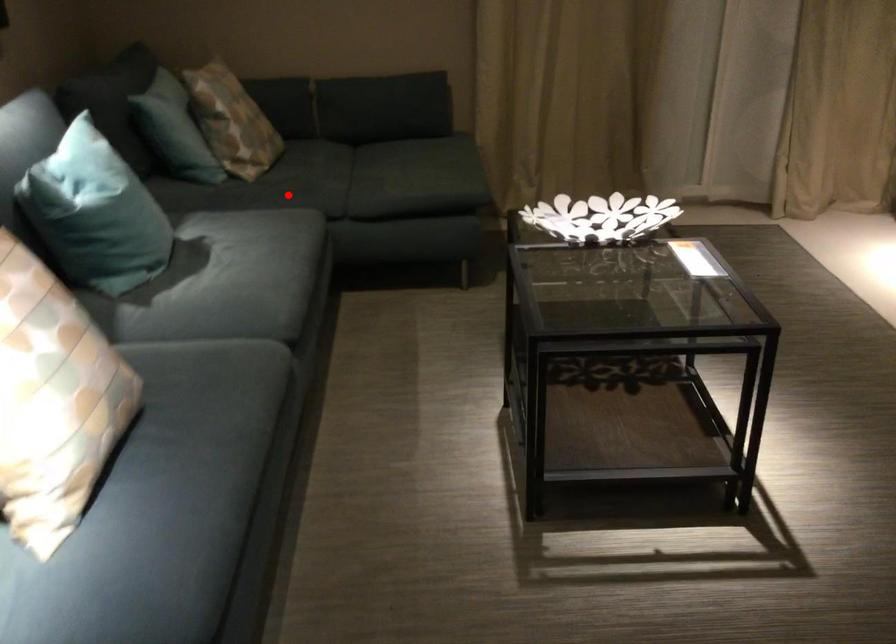
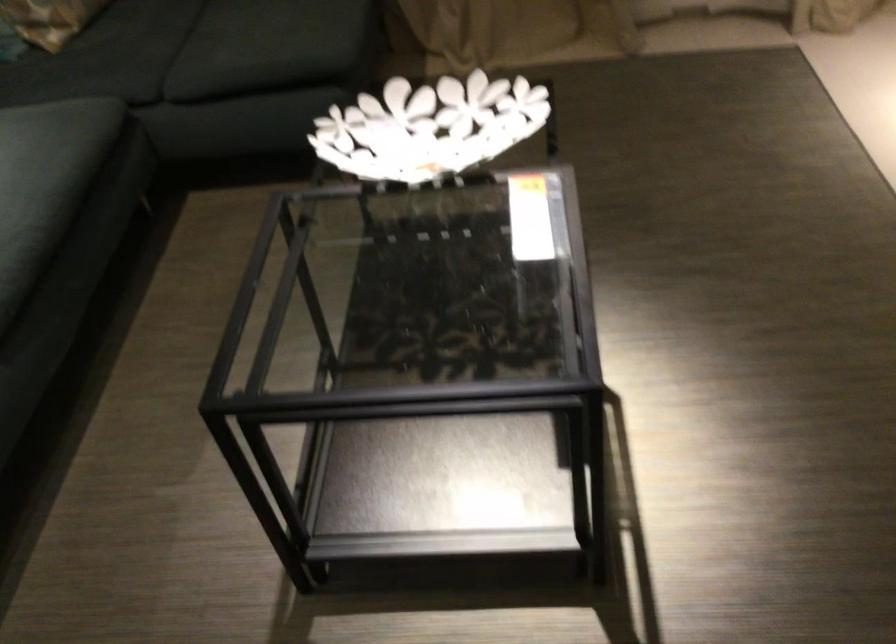
The point at the highlighted location is marked in the first image. Where is the corresponding point in the second image?

(85, 73)